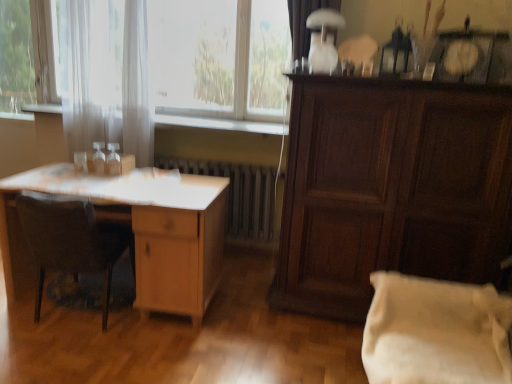
Question: Does dark wood cabinet at right have a greater height compared to white wood at center?

Choices:
 (A) yes
 (B) no

Answer: (A)

Question: Considering the relative positions of dark wood cabinet at right and white wood at center in the image provided, is dark wood cabinet at right to the left of white wood at center from the viewer's perspective?

Choices:
 (A) no
 (B) yes

Answer: (A)

Question: Is dark wood cabinet at right shorter than white wood at center?

Choices:
 (A) no
 (B) yes

Answer: (A)

Question: Is dark wood cabinet at right bigger than white wood at center?

Choices:
 (A) no
 (B) yes

Answer: (B)

Question: From a real-world perspective, is dark wood cabinet at right under white wood at center?

Choices:
 (A) no
 (B) yes

Answer: (B)

Question: From a real-world perspective, is dark wood cabinet at right located higher than white wood at center?

Choices:
 (A) yes
 (B) no

Answer: (B)

Question: Is white matte curtain at upper center, acting as the second curtain starting from the left, not inside white sheer curtain at left, placed as the 1th curtain when sorted from left to right?

Choices:
 (A) yes
 (B) no

Answer: (A)

Question: Is white matte curtain at upper center, marked as the second curtain in a back-to-front arrangement, further to camera compared to white sheer curtain at left, the second curtain when ordered from right to left?

Choices:
 (A) yes
 (B) no

Answer: (B)

Question: Is white matte curtain at upper center, which ranks as the 1th curtain in front-to-back order, facing towards white sheer curtain at left, the second curtain positioned from the front?

Choices:
 (A) yes
 (B) no

Answer: (B)

Question: From a real-world perspective, is white matte curtain at upper center, marked as the second curtain in a back-to-front arrangement, on white sheer curtain at left, placed as the 1th curtain when sorted from left to right?

Choices:
 (A) yes
 (B) no

Answer: (A)

Question: Is white matte curtain at upper center, acting as the second curtain starting from the left, at the right side of white sheer curtain at left, the second curtain positioned from the front?

Choices:
 (A) no
 (B) yes

Answer: (B)

Question: Does white matte curtain at upper center, marked as the second curtain in a back-to-front arrangement, have a larger size compared to white sheer curtain at left, the second curtain positioned from the front?

Choices:
 (A) no
 (B) yes

Answer: (A)

Question: From a real-world perspective, does white sheer curtain at left, placed as the 1th curtain when sorted from left to right, stand above metallic silver radiator at center?

Choices:
 (A) yes
 (B) no

Answer: (A)